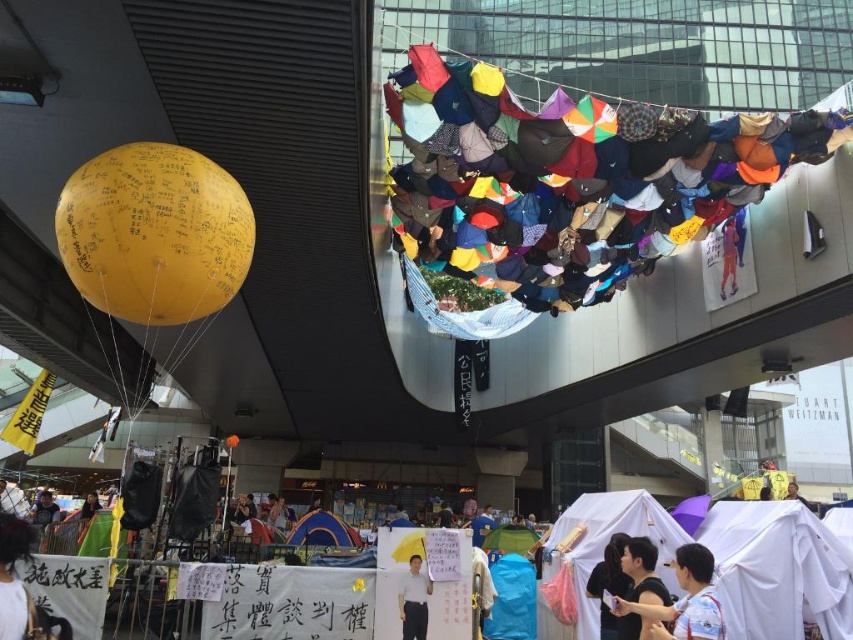
Question: Among these points, which one is farthest from the camera?

Choices:
 (A) pyautogui.click(x=724, y=275)
 (B) pyautogui.click(x=656, y=609)

Answer: (A)

Question: Can you confirm if white cotton shirt at lower right is bigger than matte black shirt at center?

Choices:
 (A) no
 (B) yes

Answer: (A)

Question: Among these objects, which one is farthest from the camera?

Choices:
 (A) light brown fabric at lower left
 (B) white cotton shirt at lower right
 (C) white cotton shirt at center

Answer: (A)

Question: Does yellow matte balloon at left appear over white cotton shirt at lower right?

Choices:
 (A) yes
 (B) no

Answer: (A)

Question: Which point is closer to the camera?

Choices:
 (A) blue fabric tent at center
 (B) white cotton shirt at lower right

Answer: (B)

Question: Does yellow matte balloon at left have a larger size compared to white cotton shirt at lower right?

Choices:
 (A) yes
 (B) no

Answer: (A)